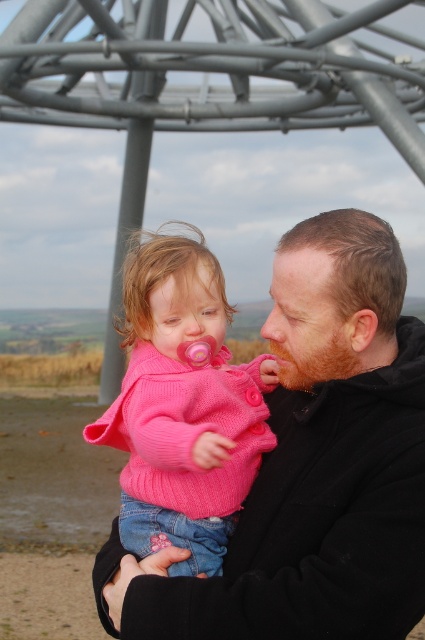
Looking at this image, is black matte jacket at center wider than pink knitted sweater at center?

Correct, the width of black matte jacket at center exceeds that of pink knitted sweater at center.

Image resolution: width=425 pixels, height=640 pixels. What do you see at coordinates (314, 465) in the screenshot?
I see `black matte jacket at center` at bounding box center [314, 465].

This screenshot has height=640, width=425. Identify the location of black matte jacket at center. (314, 465).